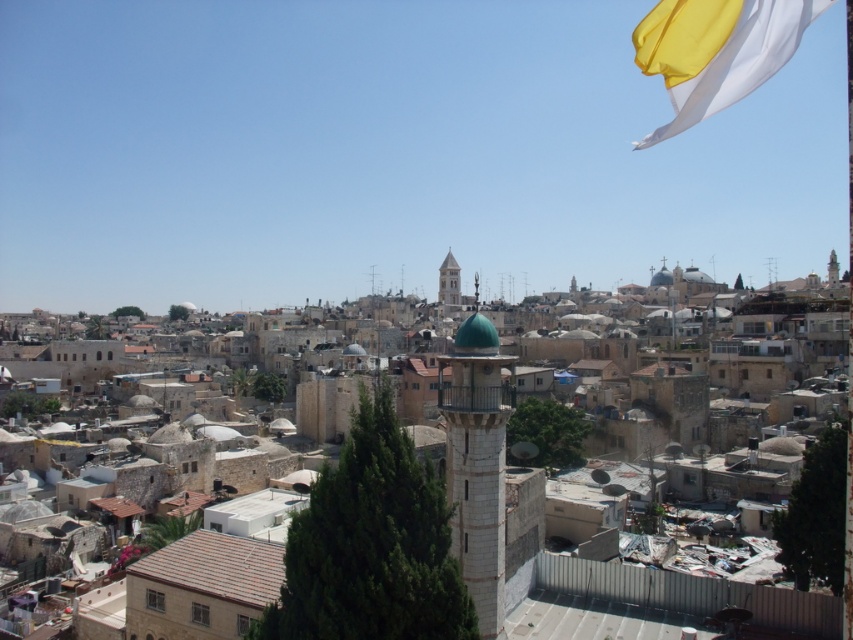
Question: Which point is closer to the camera?

Choices:
 (A) (722, 16)
 (B) (463, 324)
 (C) (506, 406)
 (D) (442, 300)

Answer: (A)

Question: Does white stone tower at center have a larger size compared to white silky flag at upper right?

Choices:
 (A) no
 (B) yes

Answer: (A)

Question: Among these objects, which one is nearest to the camera?

Choices:
 (A) light beige stone tower at center
 (B) white silky flag at upper right
 (C) white stone tower at center
 (D) stone minaret at center

Answer: (B)

Question: Which of the following is the farthest from the observer?

Choices:
 (A) (642, 20)
 (B) (466, 419)
 (C) (503, 404)

Answer: (A)

Question: Is white silky flag at upper right further to camera compared to light beige stone tower at center?

Choices:
 (A) yes
 (B) no

Answer: (B)

Question: From the image, what is the correct spatial relationship of stone minaret at center in relation to light beige stone tower at center?

Choices:
 (A) above
 (B) below

Answer: (B)